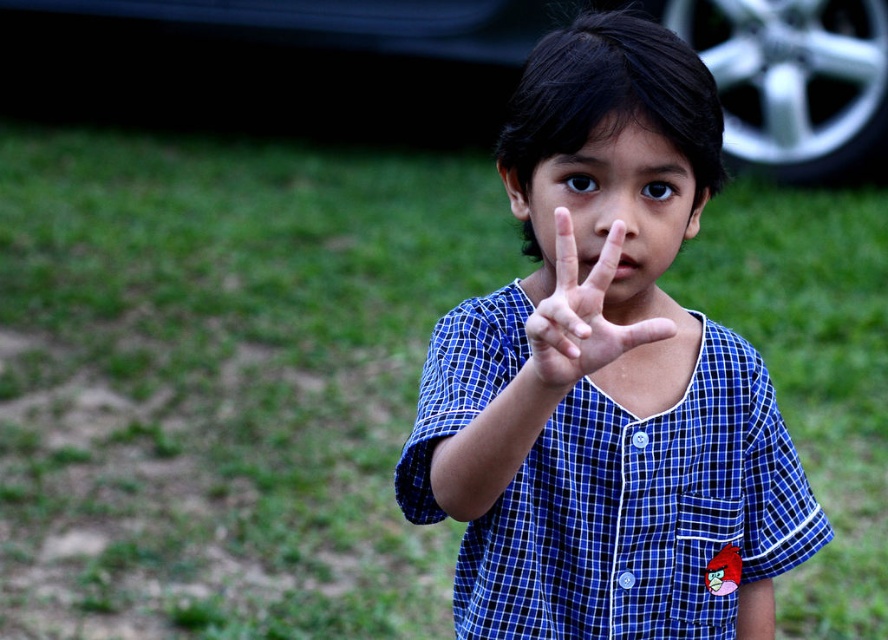
You are a photographer trying to capture the metallic silver car at upper right and the blue plaid shirt at center in the same frame. Based on the scene, which object appears larger in the photo?

The metallic silver car at upper right appears larger in the photo because it is much taller than the blue plaid shirt at center.

You are a photographer trying to capture a clear shot of the blue checkered shirt at center and the metallic silver car at upper right. Since the shirt is smaller than the car, which object should you zoom in on to ensure both are visible in the frame?

The blue checkered shirt at center is smaller than the metallic silver car at upper right. To ensure both are visible, you should zoom out slightly to accommodate the larger car while still showing the smaller shirt.

You are a photographer trying to capture a clear shot of the blue checkered shirt at center and the metallic silver car at upper right. Based on the scene, which object is positioned lower in the image?

The blue checkered shirt at center is positioned lower than the metallic silver car at upper right.